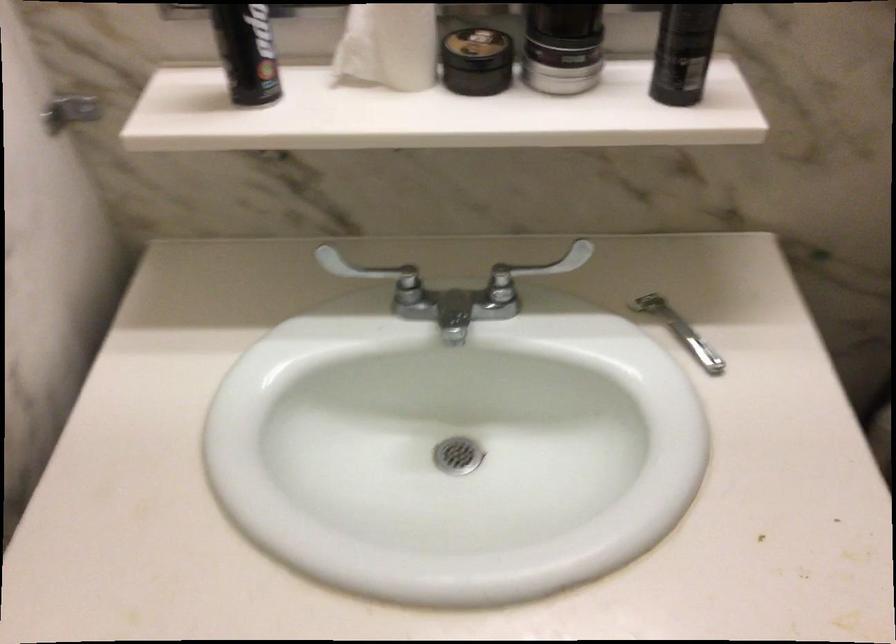
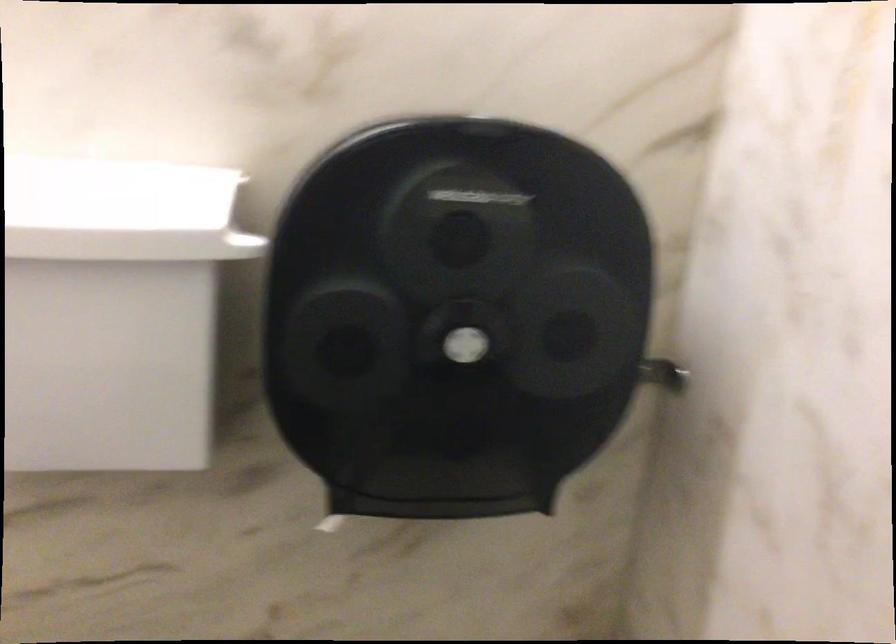
Question: The images are taken continuously from a first-person perspective. In which direction is your viewpoint rotating?

Choices:
 (A) Left
 (B) Right
 (C) Up
 (D) Down

Answer: (C)